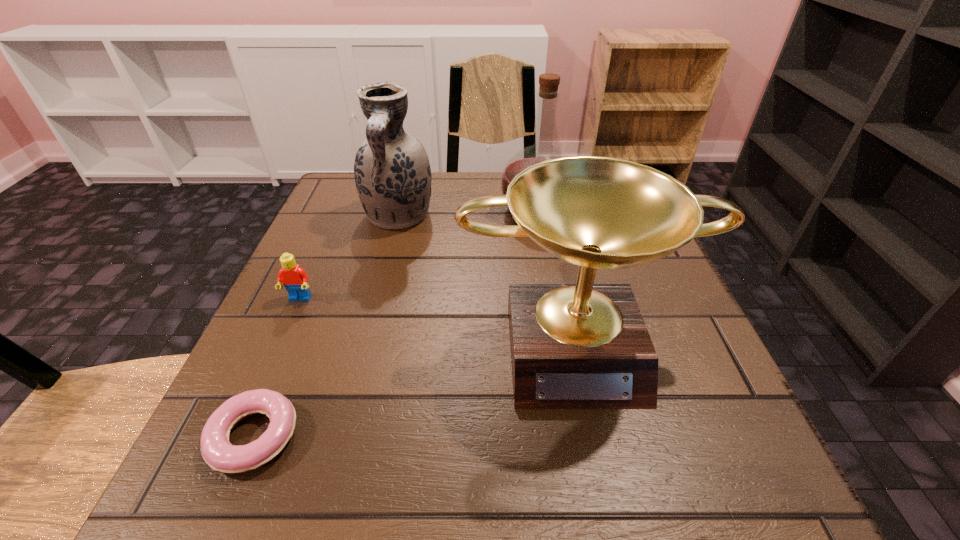
Locate an element on the screen. This screenshot has height=540, width=960. unoccupied position between the award and the vase is located at coordinates (487, 280).

Where is `free space that is in between the liquor and the award`? This screenshot has height=540, width=960. free space that is in between the liquor and the award is located at coordinates (556, 276).

Where is `vacant space that is in between the award and the shortest object`? The height and width of the screenshot is (540, 960). vacant space that is in between the award and the shortest object is located at coordinates (415, 389).

Locate an element on the screen. The image size is (960, 540). vacant space that's between the award and the doughnut is located at coordinates (415, 389).

Identify which object is the fourth nearest to the award. Please provide its 2D coordinates. Your answer should be formatted as a tuple, i.e. [(x, y)], where the tuple contains the x and y coordinates of a point satisfying the conditions above.

[(295, 280)]

Identify which object is located as the fourth nearest to the liquor. Please provide its 2D coordinates. Your answer should be formatted as a tuple, i.e. [(x, y)], where the tuple contains the x and y coordinates of a point satisfying the conditions above.

[(217, 451)]

Where is `free space that satisfies the following two spatial constraints: 1. on the face of the fourth tallest object; 2. on the right side of the shortest object`? free space that satisfies the following two spatial constraints: 1. on the face of the fourth tallest object; 2. on the right side of the shortest object is located at coordinates (239, 436).

Where is `vacant space that satisfies the following two spatial constraints: 1. on the face of the doughnut; 2. on the right side of the Lego`? Image resolution: width=960 pixels, height=540 pixels. vacant space that satisfies the following two spatial constraints: 1. on the face of the doughnut; 2. on the right side of the Lego is located at coordinates (239, 436).